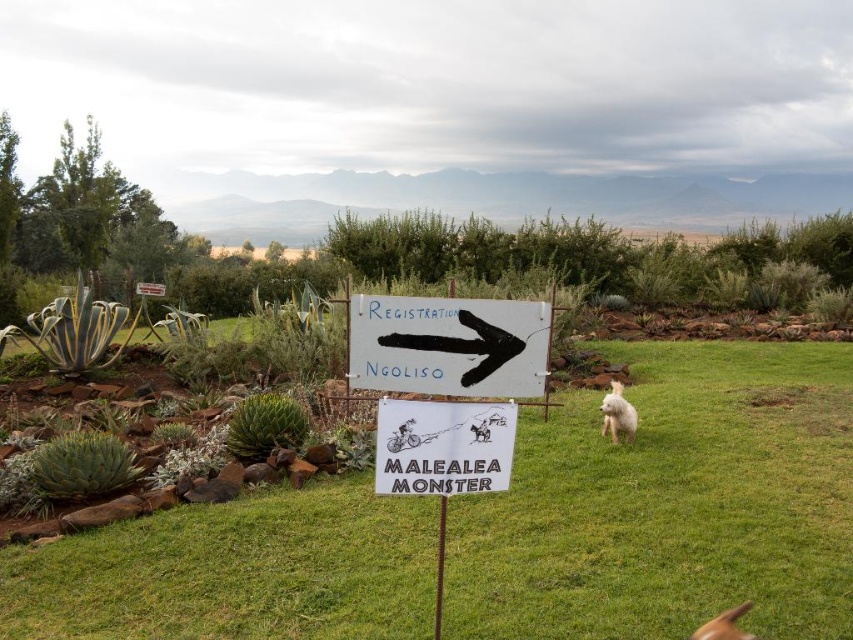
Question: Which point is farther from the camera taking this photo?

Choices:
 (A) (624, 428)
 (B) (735, 616)
 (C) (460, 301)
 (D) (424, 464)

Answer: (A)

Question: Does green grass at center have a smaller size compared to white fluffy dog at lower right?

Choices:
 (A) yes
 (B) no

Answer: (A)

Question: Does green grass at center appear under white fluffy dog at right?

Choices:
 (A) yes
 (B) no

Answer: (A)

Question: Estimate the real-world distances between objects in this image. Which object is closer to the white fluffy dog at lower right?

Choices:
 (A) green grass at center
 (B) black painted arrow at center
 (C) white fluffy dog at right
 (D) white paper sign at center

Answer: (D)

Question: Which of the following is the farthest from the observer?

Choices:
 (A) (735, 627)
 (B) (373, 356)
 (C) (498, 481)

Answer: (A)

Question: Is green grass at center positioned at the back of white fluffy dog at right?

Choices:
 (A) yes
 (B) no

Answer: (B)